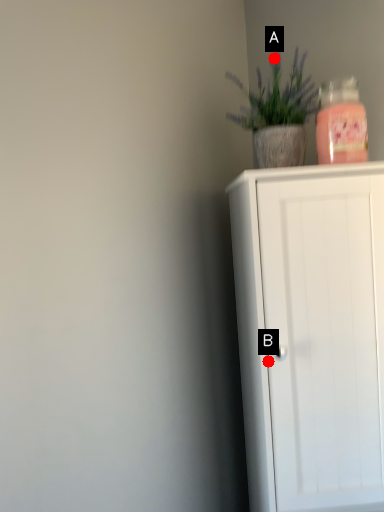
Question: Two points are circled on the image, labeled by A and B beside each circle. Which point is farther to the camera?

Choices:
 (A) A is further
 (B) B is further

Answer: (A)